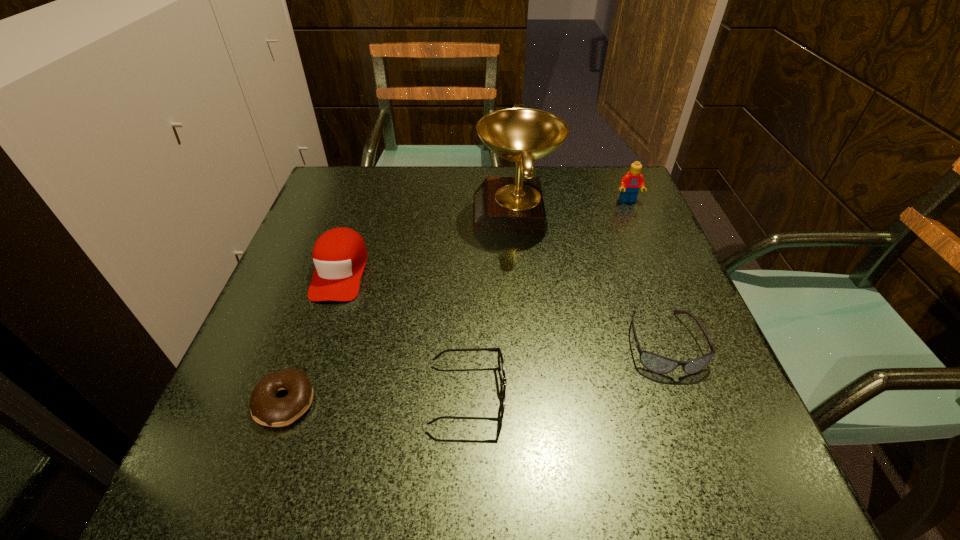
Image resolution: width=960 pixels, height=540 pixels. Find the location of `vacant point that satisfies the following two spatial constraints: 1. on the lenses of the sunglasses; 2. on the front-facing side of the spectacles`. vacant point that satisfies the following two spatial constraints: 1. on the lenses of the sunglasses; 2. on the front-facing side of the spectacles is located at coordinates (683, 395).

This screenshot has height=540, width=960. Find the location of `vacant space that satisfies the following two spatial constraints: 1. on the front-facing side of the spectacles; 2. on the front side of the doughnut`. vacant space that satisfies the following two spatial constraints: 1. on the front-facing side of the spectacles; 2. on the front side of the doughnut is located at coordinates (468, 402).

At what (x,y) coordinates should I click in order to perform the action: click on free location that satisfies the following two spatial constraints: 1. on the front-facing side of the award; 2. on the front-facing side of the third tallest object. Please return your answer as a coordinate pair (x, y). This screenshot has width=960, height=540. Looking at the image, I should click on (520, 272).